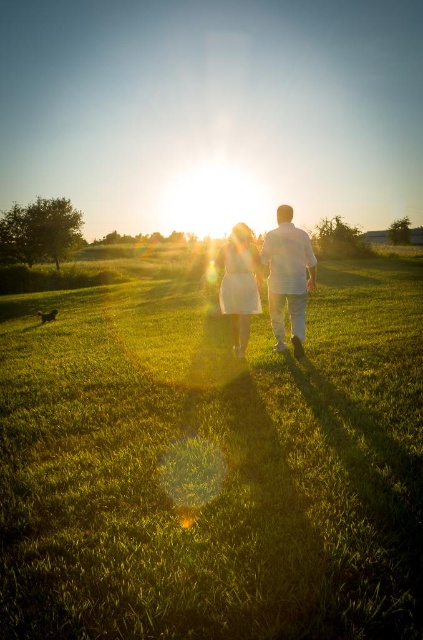
Question: Which object is positioned closest to the white cotton shirt at center?

Choices:
 (A) green grassy field at center
 (B) white matte dress at center

Answer: (B)

Question: Does green grassy field at center appear on the right side of white matte dress at center?

Choices:
 (A) yes
 (B) no

Answer: (B)

Question: Which object is closer to the camera taking this photo?

Choices:
 (A) green grassy field at center
 (B) white cotton shirt at center
 (C) white matte dress at center

Answer: (A)

Question: Which of the following is the farthest from the observer?

Choices:
 (A) white matte dress at center
 (B) white cotton shirt at center
 (C) green grassy field at center

Answer: (A)

Question: Can you confirm if green grassy field at center is positioned above white matte dress at center?

Choices:
 (A) yes
 (B) no

Answer: (B)

Question: Is white cotton shirt at center above white matte dress at center?

Choices:
 (A) no
 (B) yes

Answer: (A)